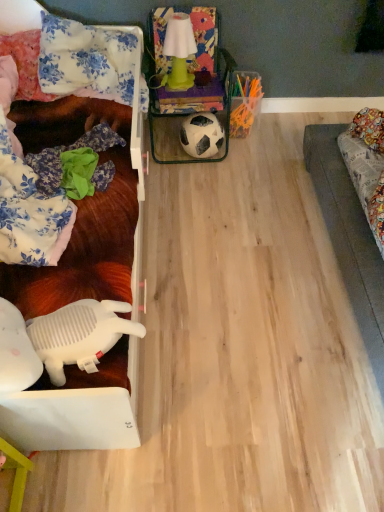
Question: From the image's perspective, is green matte lamp at upper center beneath white plastic toy at lower left?

Choices:
 (A) no
 (B) yes

Answer: (A)

Question: Considering the relative sizes of green matte lamp at upper center and white plastic toy at lower left in the image provided, is green matte lamp at upper center thinner than white plastic toy at lower left?

Choices:
 (A) yes
 (B) no

Answer: (A)

Question: From a real-world perspective, is green matte lamp at upper center physically below white plastic toy at lower left?

Choices:
 (A) no
 (B) yes

Answer: (A)

Question: Considering the relative sizes of green matte lamp at upper center and white plastic toy at lower left in the image provided, is green matte lamp at upper center smaller than white plastic toy at lower left?

Choices:
 (A) yes
 (B) no

Answer: (A)

Question: Is the depth of green matte lamp at upper center less than that of white plastic toy at lower left?

Choices:
 (A) no
 (B) yes

Answer: (A)

Question: Considering the relative positions of green matte lamp at upper center and white plastic toy at lower left in the image provided, is green matte lamp at upper center behind white plastic toy at lower left?

Choices:
 (A) yes
 (B) no

Answer: (A)

Question: Can you confirm if white plastic toy at lower left is positioned to the left of floral fabric pillow at upper left, the 2th pillow from the left?

Choices:
 (A) no
 (B) yes

Answer: (A)

Question: Is white plastic toy at lower left oriented away from floral fabric pillow at upper left, the 2th pillow from the left?

Choices:
 (A) no
 (B) yes

Answer: (A)

Question: Is white plastic toy at lower left outside of floral fabric pillow at upper left, acting as the first pillow starting from the right?

Choices:
 (A) no
 (B) yes

Answer: (B)

Question: From the image's perspective, would you say white plastic toy at lower left is shown under floral fabric pillow at upper left, the 2th pillow from the left?

Choices:
 (A) yes
 (B) no

Answer: (A)

Question: Is there a large distance between white plastic toy at lower left and floral fabric pillow at upper left, the 2th pillow from the left?

Choices:
 (A) no
 (B) yes

Answer: (B)

Question: Does white plastic toy at lower left have a larger size compared to floral fabric pillow at upper left, the 2th pillow from the left?

Choices:
 (A) yes
 (B) no

Answer: (B)

Question: Does floral fabric pillow at upper left, acting as the first pillow starting from the right, have a smaller size compared to white matte football at center?

Choices:
 (A) no
 (B) yes

Answer: (A)